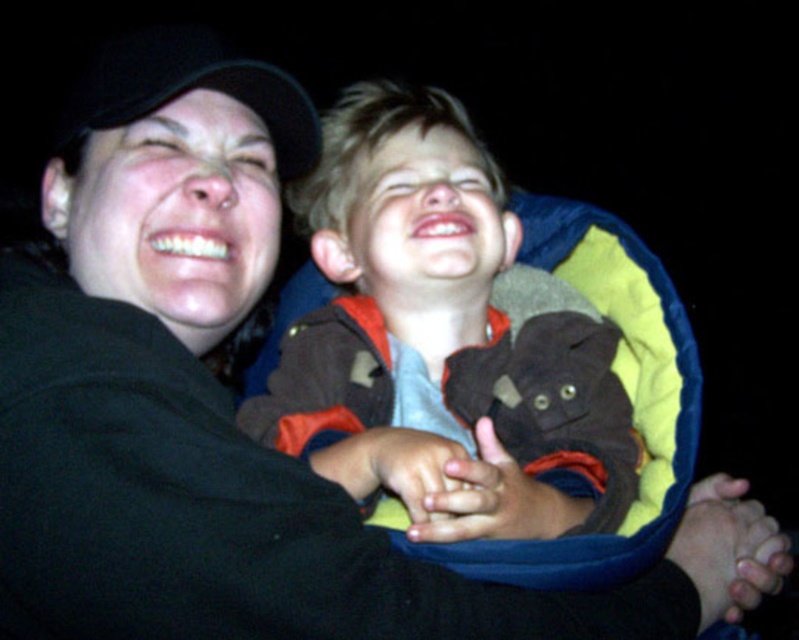
Question: Which of the following is the farthest from the observer?

Choices:
 (A) brown fuzzy stuffed animal at center
 (B) black fabric baseball cap at upper left

Answer: (B)

Question: Can you confirm if brown fuzzy stuffed animal at center is thinner than black fabric baseball cap at upper left?

Choices:
 (A) no
 (B) yes

Answer: (A)

Question: Is brown fuzzy stuffed animal at center bigger than black fabric baseball cap at upper left?

Choices:
 (A) yes
 (B) no

Answer: (A)

Question: Is brown fuzzy stuffed animal at center further to camera compared to black fabric baseball cap at upper left?

Choices:
 (A) yes
 (B) no

Answer: (B)